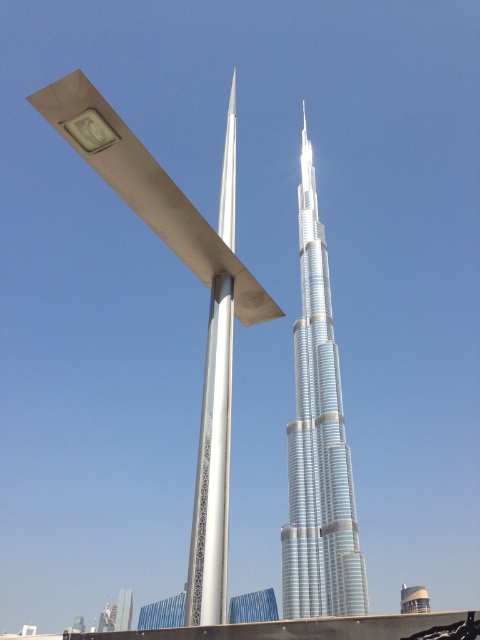
Does silver metallic burj khalifa at center have a larger size compared to silver metallic pole at center?

Correct, silver metallic burj khalifa at center is larger in size than silver metallic pole at center.

Is silver metallic burj khalifa at center positioned behind silver metallic pole at center?

Yes, silver metallic burj khalifa at center is further from the viewer.

This screenshot has width=480, height=640. I want to click on silver metallic burj khalifa at center, so click(317, 444).

At what (x,y) coordinates should I click in order to perform the action: click on silver metallic burj khalifa at center. Please return your answer as a coordinate pair (x, y). Looking at the image, I should click on (317, 444).